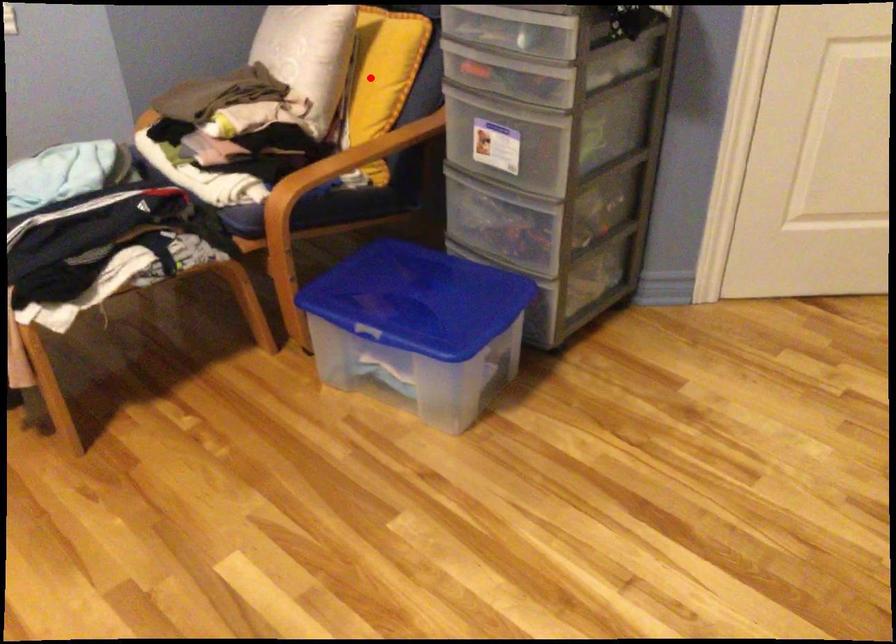
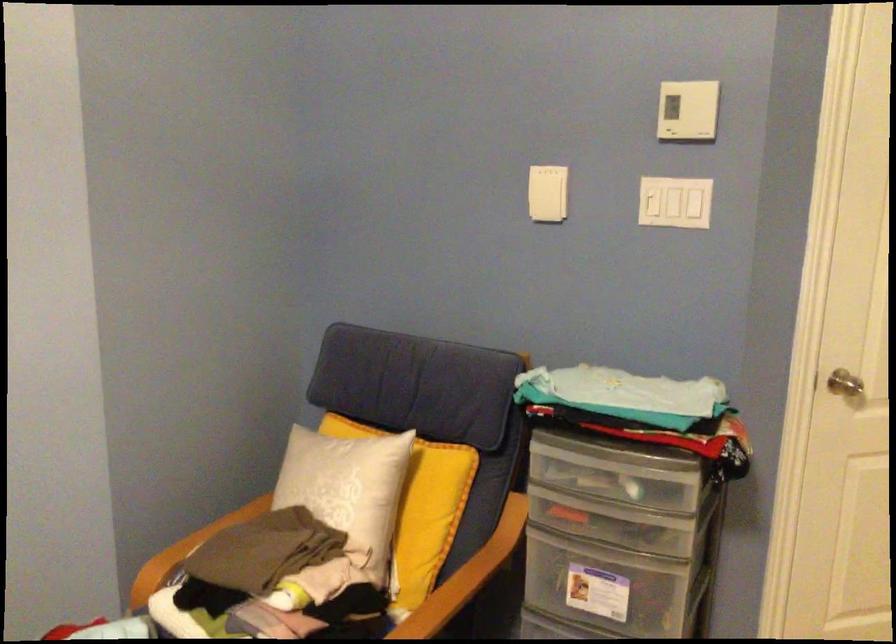
Find the pixel in the second image that matches the highlighted location in the first image.

(419, 507)